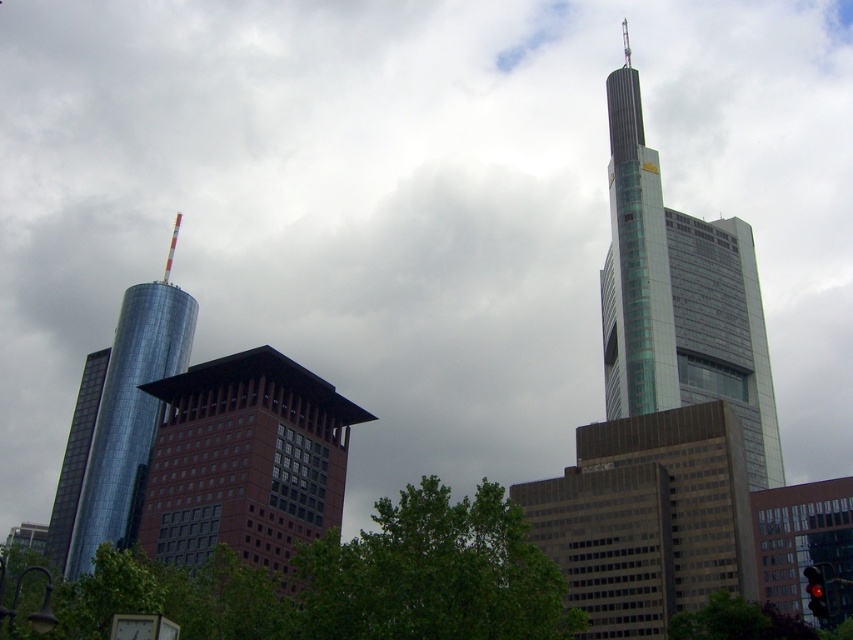
You are standing at the center of the city square and looking towards the glassy teal skyscraper at upper right. What are the coordinates of its position in the image?

The glassy teal skyscraper at upper right is located at coordinates (679, 298).

You are a drone operator trying to deliver a package to the glassy teal skyscraper at upper right. Your drone is currently hovering at point coordinates of (679, 298). Is the glassy teal skyscraper at upper right located directly above this point?

The point coordinates (679, 298) correspond to the location of the glassy teal skyscraper at upper right, so yes, the glassy teal skyscraper at upper right is directly above this point.